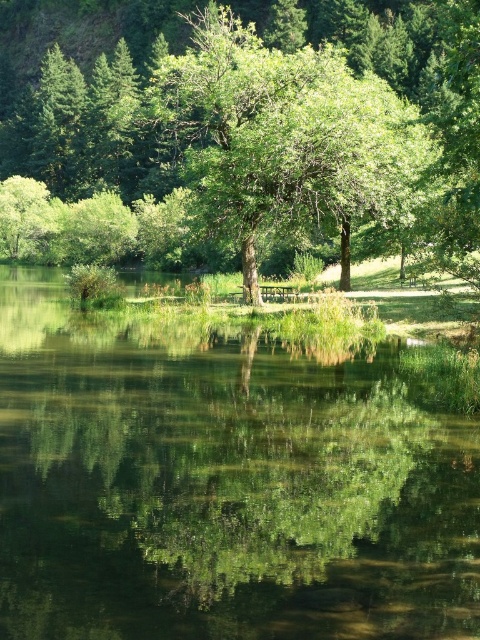
Consider the image. Is green reflective water at center wider than green leafy tree at center?

In fact, green reflective water at center might be narrower than green leafy tree at center.

The image size is (480, 640). What do you see at coordinates (222, 486) in the screenshot? I see `green reflective water at center` at bounding box center [222, 486].

The height and width of the screenshot is (640, 480). What do you see at coordinates (222, 486) in the screenshot?
I see `green reflective water at center` at bounding box center [222, 486].

Where is `green reflective water at center`? green reflective water at center is located at coordinates (222, 486).